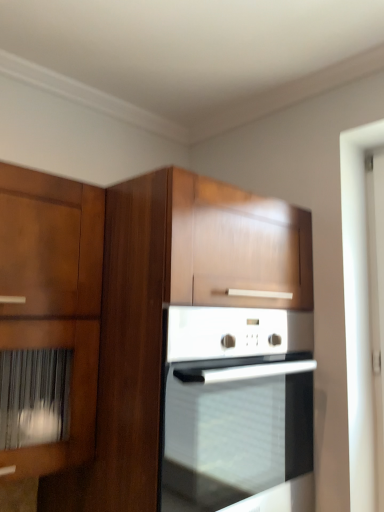
Question: Can you confirm if wooden cabinet at center is wider than white glossy screen door at right?

Choices:
 (A) no
 (B) yes

Answer: (B)

Question: Can you confirm if wooden cabinet at center is smaller than white glossy screen door at right?

Choices:
 (A) no
 (B) yes

Answer: (A)

Question: Can you confirm if wooden cabinet at center is bigger than white glossy screen door at right?

Choices:
 (A) yes
 (B) no

Answer: (A)

Question: Would you say white glossy screen door at right is part of wooden cabinet at center's contents?

Choices:
 (A) yes
 (B) no

Answer: (B)

Question: Can you see wooden cabinet at center touching white glossy screen door at right?

Choices:
 (A) yes
 (B) no

Answer: (B)

Question: In terms of height, does white glossy oven at center look taller or shorter compared to wooden cabinet at center?

Choices:
 (A) short
 (B) tall

Answer: (A)

Question: Is white glossy oven at center to the left or to the right of wooden cabinet at center in the image?

Choices:
 (A) left
 (B) right

Answer: (B)

Question: From the image's perspective, is white glossy oven at center above or below wooden cabinet at center?

Choices:
 (A) below
 (B) above

Answer: (A)

Question: In terms of width, does white glossy oven at center look wider or thinner when compared to wooden cabinet at center?

Choices:
 (A) thin
 (B) wide

Answer: (B)

Question: Considering their positions, is wooden cabinet at center located in front of or behind white glossy screen door at right?

Choices:
 (A) behind
 (B) front

Answer: (B)

Question: Is wooden cabinet at center to the left or to the right of white glossy screen door at right in the image?

Choices:
 (A) right
 (B) left

Answer: (B)

Question: Is wooden cabinet at center inside or outside of white glossy screen door at right?

Choices:
 (A) outside
 (B) inside

Answer: (A)

Question: From a real-world perspective, is wooden cabinet at center above or below white glossy screen door at right?

Choices:
 (A) below
 (B) above

Answer: (A)

Question: Is white glossy oven at center situated inside white glossy screen door at right or outside?

Choices:
 (A) inside
 (B) outside

Answer: (B)

Question: From the image's perspective, is white glossy oven at center located above or below white glossy screen door at right?

Choices:
 (A) above
 (B) below

Answer: (B)